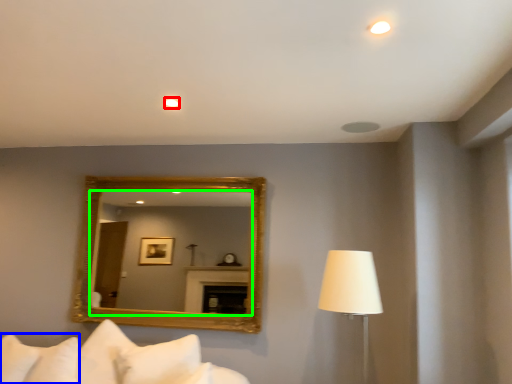
Question: Based on their relative distances, which object is farther from lighting (highlighted by a red box)? Choose from pillow (highlighted by a blue box) and mirror (highlighted by a green box).

Choices:
 (A) pillow
 (B) mirror

Answer: (B)